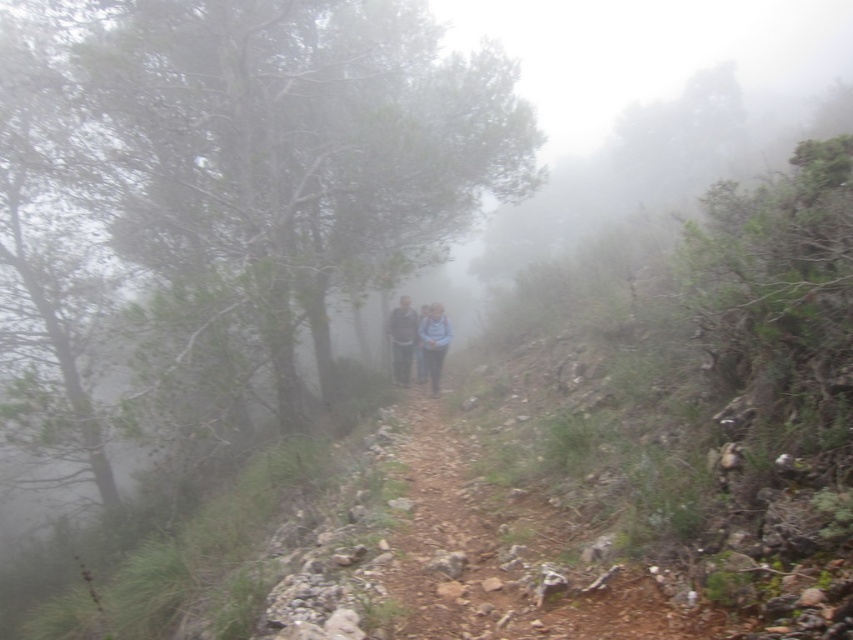
You are a hiker who has just entered the misty forest trail. You notice two items ahead on the path. One is a light blue fabric at center and the other is a dark gray sweater at center. Which item is closer to you?

The light blue fabric at center is closer to you because it is in front of the dark gray sweater at center.

You are a hiker trying to navigate the misty forest trail. You notice two points marked on your map at coordinates point (428, 328) and point (409, 324). Which point is closer to your current position if you are standing at the camera position?

Point (428, 328) is closer to the camera than point (409, 324), so it is closer to your current position.

You are a hiker on the misty forest trail and you see a light blue fabric at center and a dark gray sweater at center. Which item is higher up in the scene?

The light blue fabric at center is taller than dark gray sweater at center, so the light blue fabric at center is higher up in the scene.